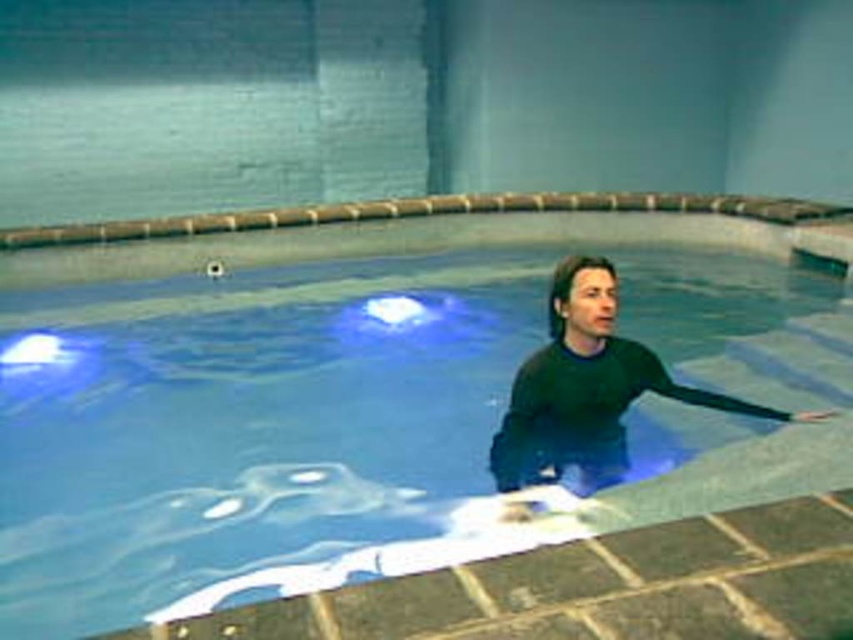
You are designing a safety poster for the indoor pool area and need to highlight the height difference between the transparent glass swimming pool at center and the black matte wetsuit at center. Which object is taller?

The transparent glass swimming pool at center is taller than the black matte wetsuit at center.

You are a lifeguard standing at the edge of the pool. You need to retrieve an object from the bottom of the transparent glass swimming pool at center. Considering the visibility, will you be able to see the black matte wetsuit at center clearly from your position?

The transparent glass swimming pool at center is closer to the viewer than the black matte wetsuit at center, so the wetsuit might be partially obscured or less visible due to its position further away from the pool edge. This could make it harder to see clearly from the lifeguard station.